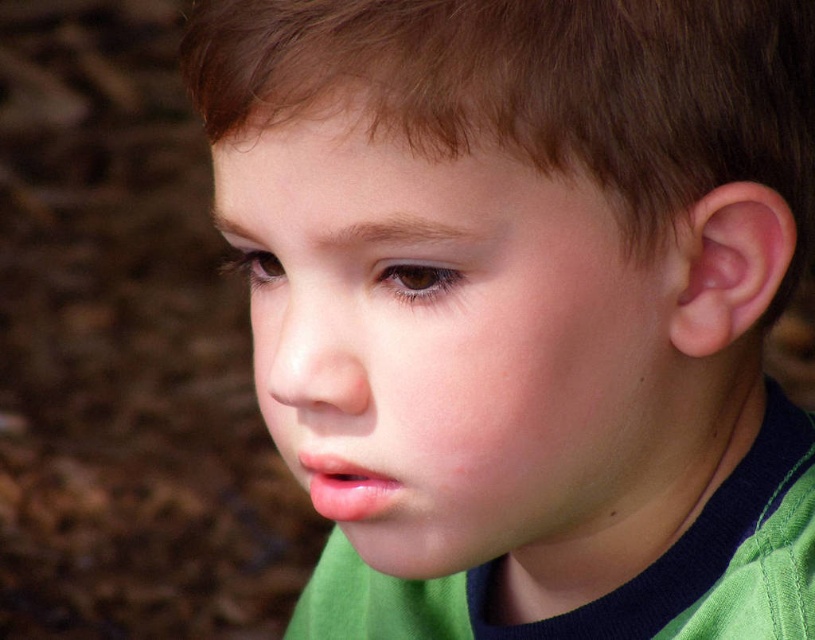
You are a photographer adjusting the focus of your camera. You want to ensure that both the smooth skin face at center and the brown matte hair at upper center are in focus. Given their sizes, which object should you prioritize focusing on first to ensure clarity?

The smooth skin face at center should be prioritized for focus first because it has a larger size compared to the brown matte hair at upper center, making it more prominent in the composition.

You are a photographer trying to capture the child in the image. You want to ensure the smooth skin face at center and the brown matte hair at upper center are both visible in the frame. Which object should you focus on first to ensure both are in focus?

The smooth skin face at center is positioned on the left side of brown matte hair at upper center, so focusing on the brown matte hair at upper center first will ensure both objects are in focus since it is closer to the camera.

Based on the photo, you are holding a small toy that needs to be placed exactly at the point marked as point [333,244] in the image. If the toy is 2 inches wide, will it fit without overlapping any other objects in the scene?

The point [333,244] is 16.23 inches from the viewer. Since the toy is only 2 inches wide, it will fit at that location without overlapping other objects as there is sufficient space.